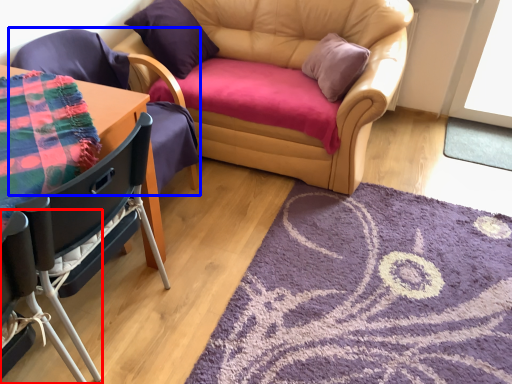
Question: Which object appears closest to the camera in this image, chair (highlighted by a red box) or chair (highlighted by a blue box)?

Choices:
 (A) chair
 (B) chair

Answer: (A)